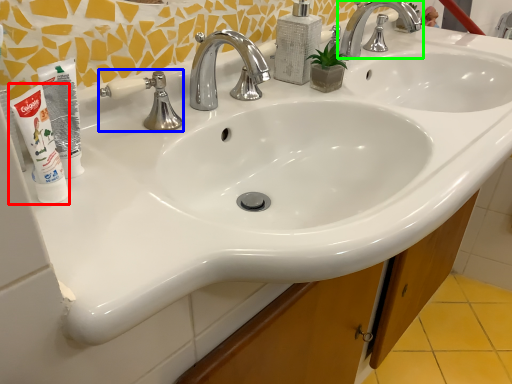
Question: Which is farther away from shaving cream (highlighted by a red box)? plumbing fixture (highlighted by a blue box) or tap (highlighted by a green box)?

Choices:
 (A) plumbing fixture
 (B) tap

Answer: (B)